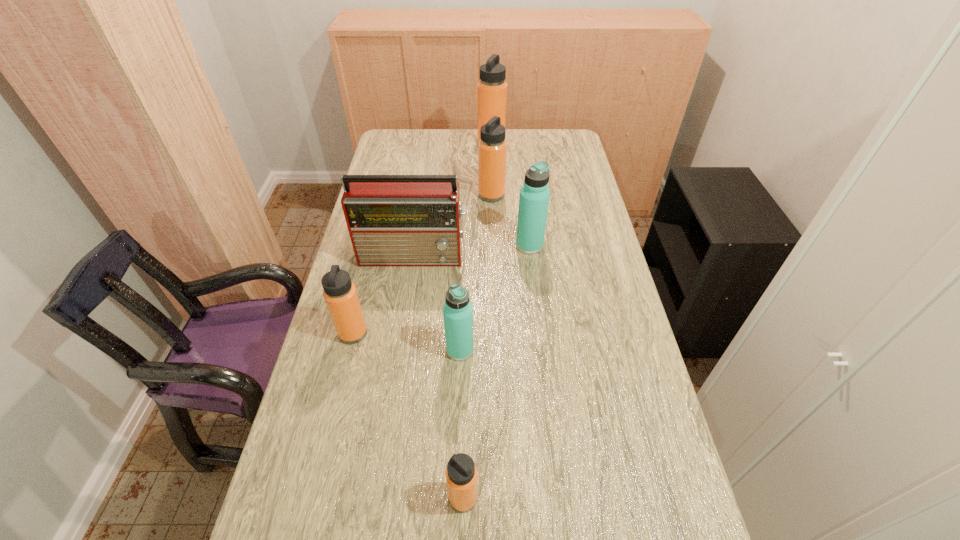
Where is `vacant space in between the bigger aqua thermos bottle and the second nearest orange thermos bottle`? vacant space in between the bigger aqua thermos bottle and the second nearest orange thermos bottle is located at coordinates pos(442,289).

Identify the location of empty location between the sixth nearest object and the fourth nearest thermos bottle. (511, 220).

The height and width of the screenshot is (540, 960). Find the location of `empty space that is in between the smallest orange thermos bottle and the radio receiver`. empty space that is in between the smallest orange thermos bottle and the radio receiver is located at coordinates (439, 376).

At what (x,y) coordinates should I click in order to perform the action: click on object that stands as the fourth closest to the nearer aqua thermos bottle. Please return your answer as a coordinate pair (x, y). Looking at the image, I should click on (534, 196).

Locate which object is the third closest to the radio receiver. Please provide its 2D coordinates. Your answer should be formatted as a tuple, i.e. [(x, y)], where the tuple contains the x and y coordinates of a point satisfying the conditions above.

[(492, 147)]

Locate which thermos bottle is the third closest to the second farthest object. Please provide its 2D coordinates. Your answer should be formatted as a tuple, i.e. [(x, y)], where the tuple contains the x and y coordinates of a point satisfying the conditions above.

[(457, 311)]

Choose which thermos bottle is the fifth nearest neighbor to the radio receiver. Please provide its 2D coordinates. Your answer should be formatted as a tuple, i.e. [(x, y)], where the tuple contains the x and y coordinates of a point satisfying the conditions above.

[(492, 88)]

Identify which orange thermos bottle is the nearest to the leftmost thermos bottle. Please provide its 2D coordinates. Your answer should be formatted as a tuple, i.e. [(x, y)], where the tuple contains the x and y coordinates of a point satisfying the conditions above.

[(461, 474)]

Image resolution: width=960 pixels, height=540 pixels. What are the coordinates of `orange thermos bottle that is the second closest one to the rightmost thermos bottle` in the screenshot? It's located at (340, 294).

Locate an element on the screen. The height and width of the screenshot is (540, 960). the second closest aqua thermos bottle to the radio receiver is located at coordinates (x=457, y=311).